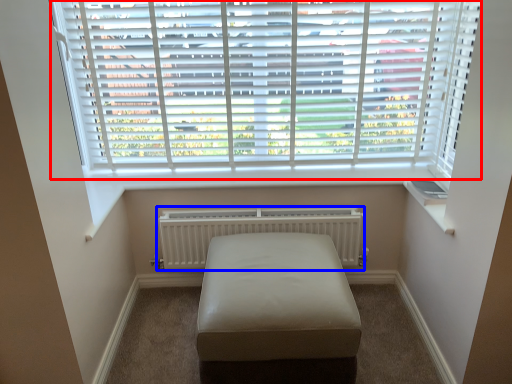
Question: Which object appears farthest to the camera in this image, window blind (highlighted by a red box) or radiator (highlighted by a blue box)?

Choices:
 (A) window blind
 (B) radiator

Answer: (B)